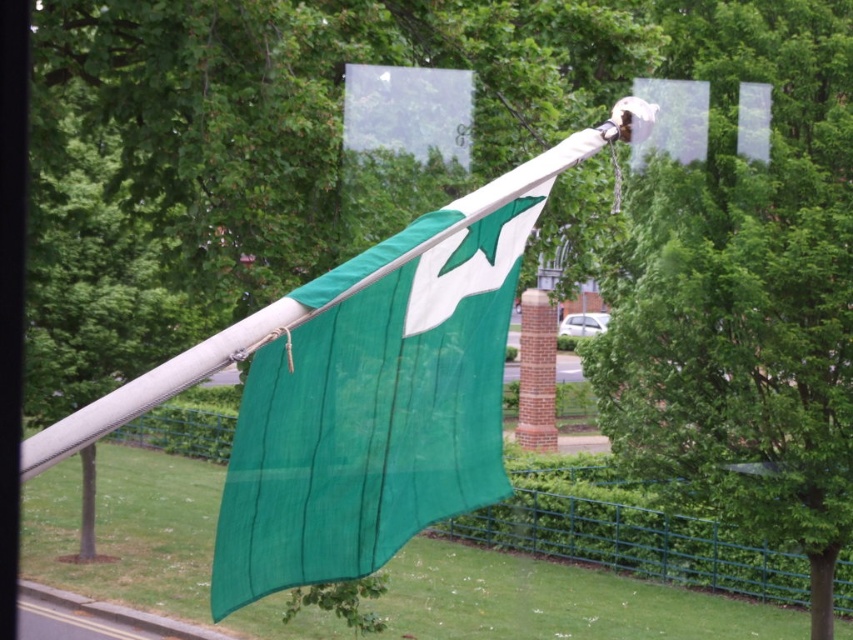
You are standing at the bottom left corner of the image, where the road is visible. You want to walk directly towards the green fabric flag at center. In which direction should you walk relative to the flag?

Since the green fabric flag at center is positioned at point [381,394], you should walk towards the upper right direction from your current position at the bottom left corner to reach it.

You are a painter who needs to paint both the green fabric flag at center and the green metal fence at lower center. Which object requires a larger amount of paint due to its size?

The green fabric flag at center requires more paint because it is much taller than the green metal fence at lower center.